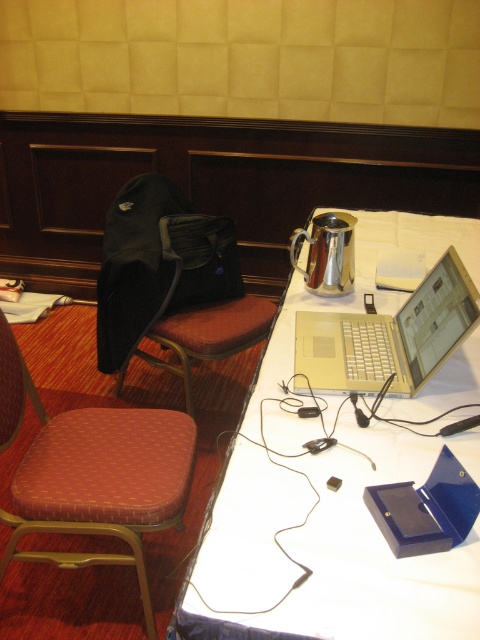
Is silver metallic table at center closer to the viewer compared to silver metallic laptop at upper right?

Yes, silver metallic table at center is in front of silver metallic laptop at upper right.

Between silver metallic table at center and silver metallic laptop at upper right, which one is positioned higher?

silver metallic table at center is higher up.

Is point (255, 492) closer to viewer compared to point (354, 314)?

Yes, point (255, 492) is in front of point (354, 314).

You are a GUI agent. You are given a task and a screenshot of the screen. Output one action in this format:
    pyautogui.click(x=<x>, y=<y>)
    Task: Click on the silver metallic table at center
    The image size is (480, 640).
    Given the screenshot: What is the action you would take?
    pos(357,557)

Is black fabric bag at left shorter than silver metallic laptop at upper right?

In fact, black fabric bag at left may be taller than silver metallic laptop at upper right.

Does point (200, 220) come behind point (414, 336)?

That is True.

Which is in front, point (194, 307) or point (344, 326)?

Point (344, 326) is in front.

Find the location of a particular element. black fabric bag at left is located at coordinates (170, 284).

Is red fabric chair at left above black fabric bag at left?

Actually, red fabric chair at left is below black fabric bag at left.

Is point (84, 522) positioned behind point (176, 330)?

No, it is not.

Image resolution: width=480 pixels, height=640 pixels. I want to click on red fabric chair at left, so click(x=93, y=474).